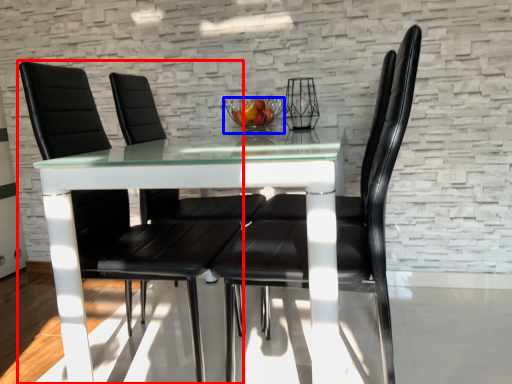
Question: Which object appears closest to the camera in this image, chair (highlighted by a red box) or glass bowl (highlighted by a blue box)?

Choices:
 (A) chair
 (B) glass bowl

Answer: (A)